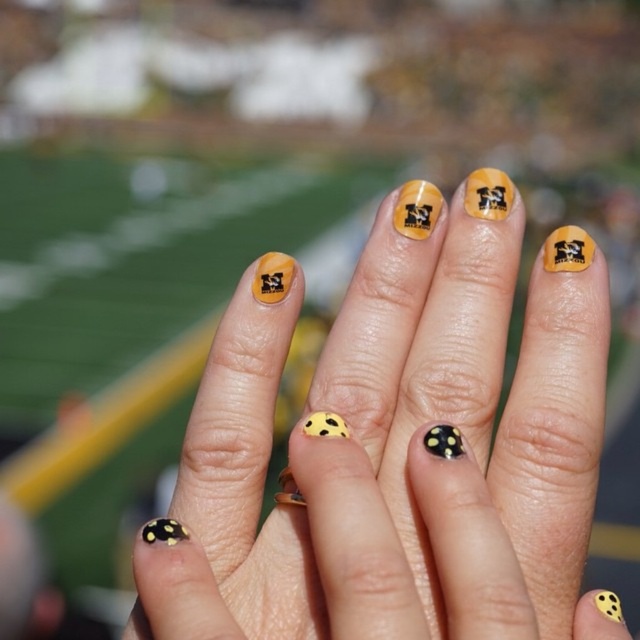
Does yellow matte nail art at center have a larger size compared to yellow matte polka dot at center?

Yes, yellow matte nail art at center is bigger than yellow matte polka dot at center.

Who is higher up, yellow matte nail art at center or yellow matte polka dot at center?

yellow matte polka dot at center is above.

Is point (531, 284) positioned in front of point (321, 422)?

That is False.

At what (x,y) coordinates should I click in order to perform the action: click on yellow matte nail art at center. Please return your answer as a coordinate pair (x, y). The image size is (640, 640). Looking at the image, I should click on (x=396, y=456).